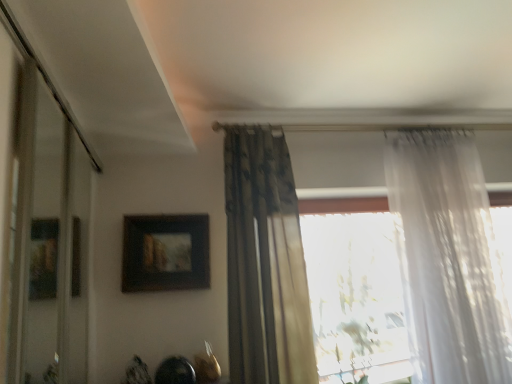
Question: From a real-world perspective, is sheer white curtain at right, the 2th curtain in the left-to-right sequence, physically located above or below matte black picture frame at upper center?

Choices:
 (A) above
 (B) below

Answer: (B)

Question: In the image, is sheer white curtain at right, the 2th curtain in the left-to-right sequence, on the left side or the right side of matte black picture frame at upper center?

Choices:
 (A) left
 (B) right

Answer: (B)

Question: Based on their relative distances, which object is nearer to the transparent glass door at left?

Choices:
 (A) sheer white curtain at right, the 2th curtain in the left-to-right sequence
 (B) matte black picture frame at upper center
 (C) dark floral fabric curtain at center, which appears as the first curtain when viewed from the left

Answer: (B)

Question: Which object is the farthest from the transparent glass door at left?

Choices:
 (A) sheer white curtain at right, the 2th curtain in the left-to-right sequence
 (B) dark floral fabric curtain at center, which appears as the first curtain when viewed from the left
 (C) matte black picture frame at upper center

Answer: (A)